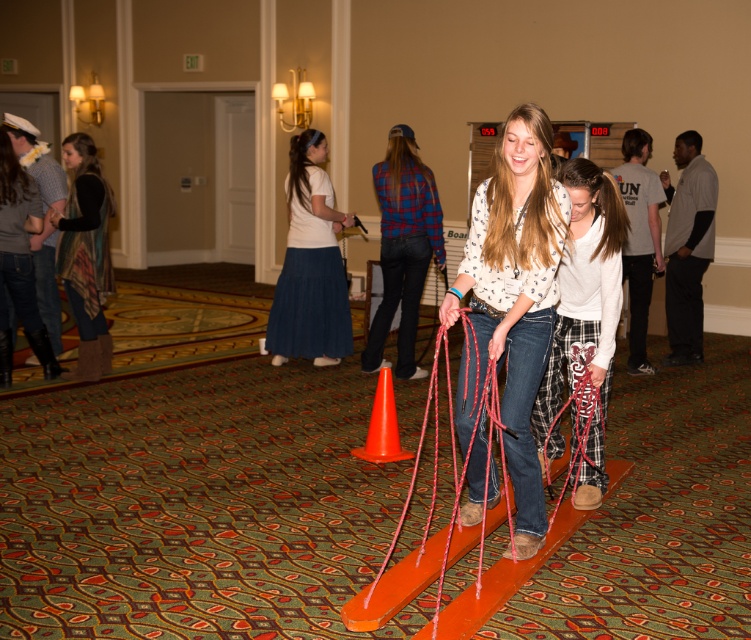
Question: Considering the relative positions of fluffy white sweater at center and denim skirt at center in the image provided, where is fluffy white sweater at center located with respect to denim skirt at center?

Choices:
 (A) below
 (B) above

Answer: (A)

Question: Can you confirm if fluffy white sweater at center is positioned to the right of orange plastic traffic cone at center?

Choices:
 (A) no
 (B) yes

Answer: (B)

Question: Is matte white blouse at center to the left of matte gray sweater at left from the viewer's perspective?

Choices:
 (A) yes
 (B) no

Answer: (B)

Question: Which is farther from the fluffy white sweater at center?

Choices:
 (A) denim skirt at center
 (B) matte gray sweater at left

Answer: (B)

Question: Which of the following is the farthest from the observer?

Choices:
 (A) fluffy white sweater at center
 (B) matte gray sweater at left
 (C) denim skirt at center

Answer: (C)

Question: Among these points, which one is nearest to the camera?

Choices:
 (A) (376, 392)
 (B) (86, 308)

Answer: (A)